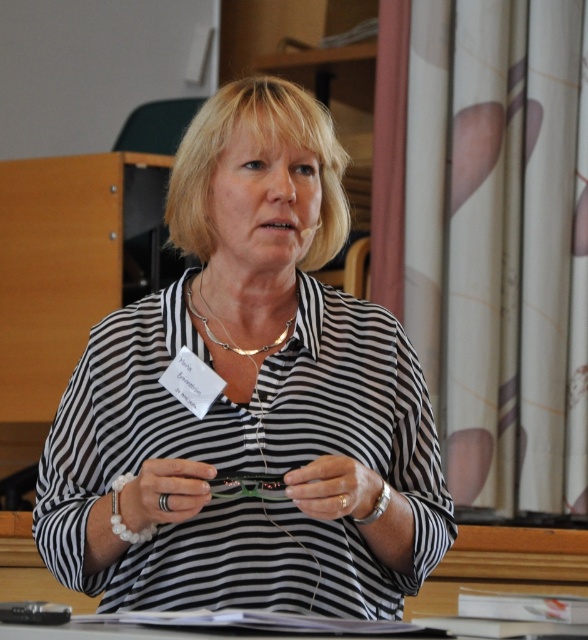
Question: Does black striped shirt at center have a smaller size compared to wooden table at lower center?

Choices:
 (A) no
 (B) yes

Answer: (A)

Question: Can you confirm if black striped shirt at center is positioned to the right of silver metallic necklace at center?

Choices:
 (A) no
 (B) yes

Answer: (B)

Question: Considering the relative positions of black striped shirt at center and black matte ring at center in the image provided, where is black striped shirt at center located with respect to black matte ring at center?

Choices:
 (A) below
 (B) above

Answer: (B)

Question: Which point is closer to the camera?

Choices:
 (A) click(x=118, y=628)
 (B) click(x=178, y=458)

Answer: (A)

Question: Which object is positioned closest to the black matte ring at center?

Choices:
 (A) black striped shirt at center
 (B) silver metallic necklace at center
 (C) white matte bracelet at center

Answer: (C)

Question: Which is nearer to the white matte bracelet at center?

Choices:
 (A) wooden table at lower center
 (B) black striped shirt at center
 (C) silver metallic necklace at center
 (D) black matte ring at center

Answer: (D)